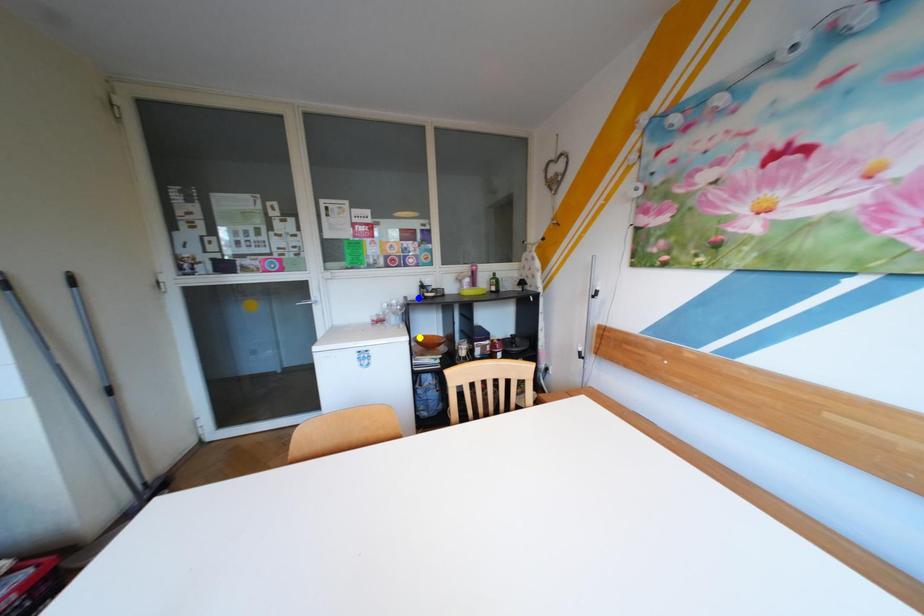
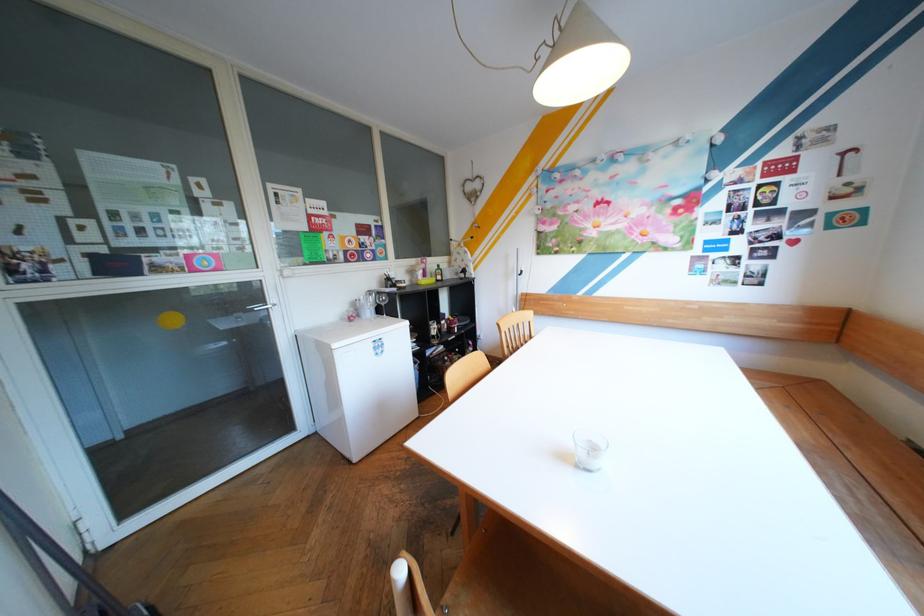
I am providing you with two images of the same scene from different viewpoints. Three points are marked in image1. Which point corresponds to a part or object that is occluded in image2?In image1, three points are marked. Which of them correspond to a part or object that is occluded in image2?Among the three points shown in image1, which one corresponds to a part or object that is no longer visible due to occlusion in image2?

Invisible in image2: green point, yellow point.